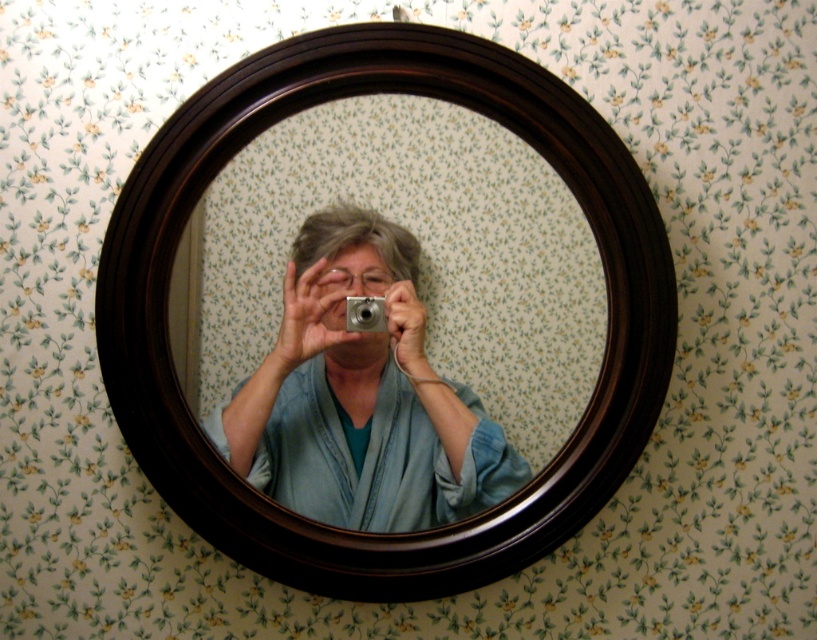
Question: Estimate the real-world distances between objects in this image. Which object is closer to the blue fabric at center?

Choices:
 (A) dark wood mirror at center
 (B) silver metallic camera at center

Answer: (A)

Question: Is dark wood mirror at center below blue fabric at center?

Choices:
 (A) no
 (B) yes

Answer: (A)

Question: Where is dark wood mirror at center located in relation to blue fabric at center in the image?

Choices:
 (A) below
 (B) above

Answer: (B)

Question: Observing the image, what is the correct spatial positioning of dark wood mirror at center in reference to blue fabric at center?

Choices:
 (A) above
 (B) below

Answer: (A)

Question: Among these points, which one is farthest from the camera?

Choices:
 (A) (266, 500)
 (B) (409, 401)

Answer: (B)

Question: Which point is closer to the camera?

Choices:
 (A) dark wood mirror at center
 (B) blue fabric at center

Answer: (A)